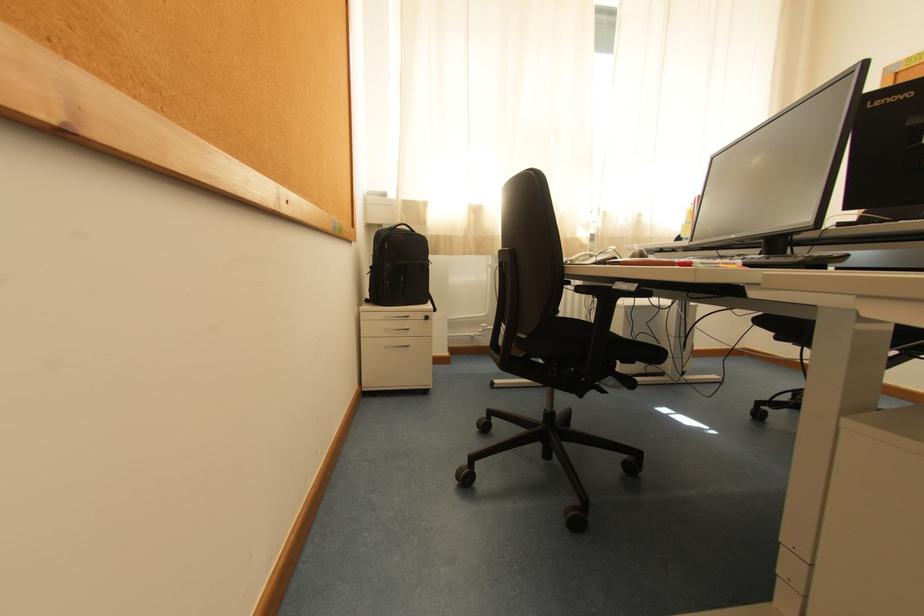
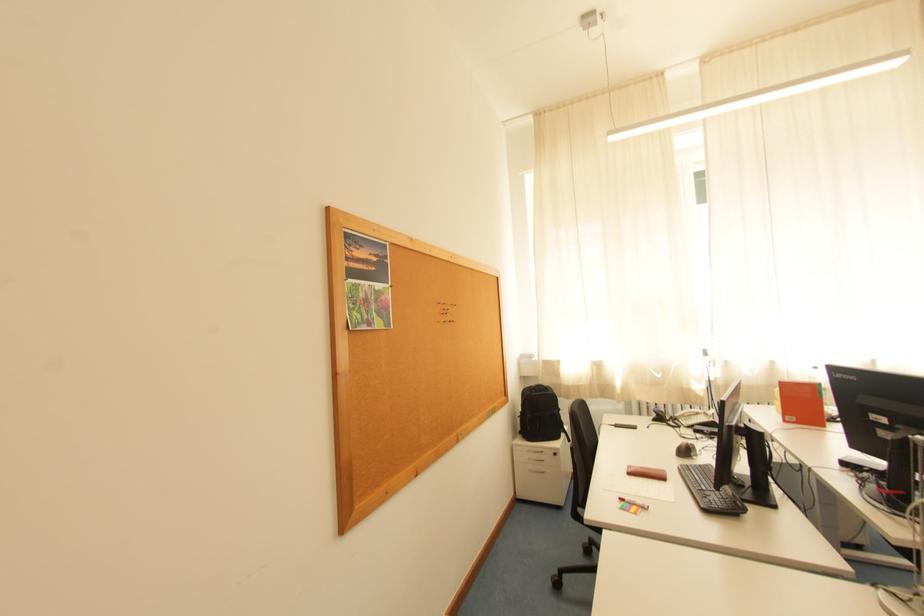
In the second image, find the point that corresponds to (x=375, y=302) in the first image.

(528, 434)